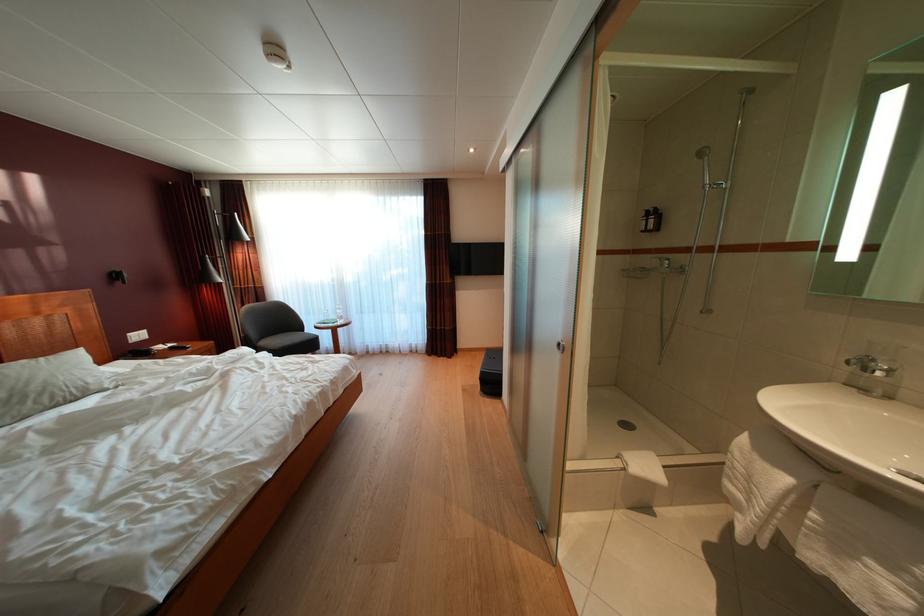
I want to click on white light switch, so click(137, 336).